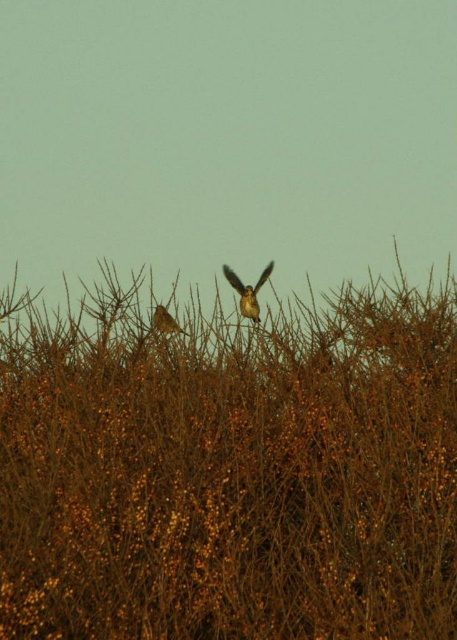
Between brown speckled feathers at center and brown textured bird at center, which one has more height?

brown speckled feathers at center

Which of these two, brown speckled feathers at center or brown textured bird at center, stands shorter?

Standing shorter between the two is brown textured bird at center.

What do you see at coordinates (248, 291) in the screenshot? The width and height of the screenshot is (457, 640). I see `brown speckled feathers at center` at bounding box center [248, 291].

You are a GUI agent. You are given a task and a screenshot of the screen. Output one action in this format:
    pyautogui.click(x=<x>, y=<y>)
    Task: Click on the brown speckled feathers at center
    Image resolution: width=457 pixels, height=640 pixels.
    Given the screenshot: What is the action you would take?
    pyautogui.click(x=248, y=291)

Is brown textured hedge at center below brown textured bird at center?

Indeed, brown textured hedge at center is positioned under brown textured bird at center.

From the picture: Who is more distant from viewer, [180,497] or [163,326]?

Point [163,326]

You are a GUI agent. You are given a task and a screenshot of the screen. Output one action in this format:
    pyautogui.click(x=<x>, y=<y>)
    Task: Click on the brown textured hedge at center
    This screenshot has width=457, height=640.
    Given the screenshot: What is the action you would take?
    pyautogui.click(x=228, y=465)

Where is `brown textured hedge at center`? This screenshot has height=640, width=457. brown textured hedge at center is located at coordinates (228, 465).

Does brown textured hedge at center have a lesser width compared to brown speckled feathers at center?

Incorrect, brown textured hedge at center's width is not less than brown speckled feathers at center's.

Which is behind, point (159, 532) or point (271, 260)?

Point (271, 260)

Describe the element at coordinates (228, 465) in the screenshot. I see `brown textured hedge at center` at that location.

Where is `brown textured hedge at center`? The image size is (457, 640). brown textured hedge at center is located at coordinates pos(228,465).